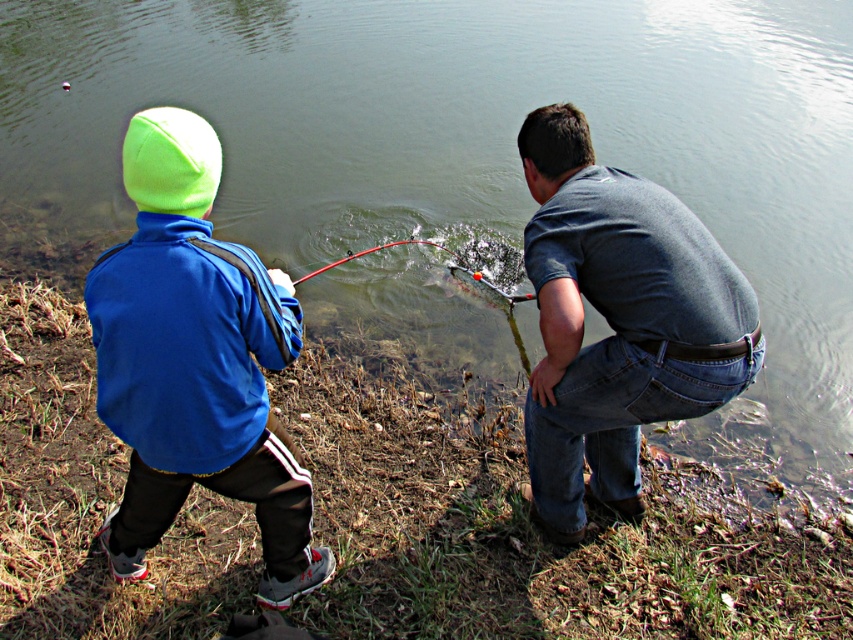
You are a fashion designer observing this fishing scene. You need to decide which item is narrower between the denim jeans at lower right and the shiny metallic rod at center. Which one is it?

The denim jeans at lower right is narrower than the shiny metallic rod at center.

You are standing at the origin point in the image, which is the bottom left corner. The coordinates are given as a normalized 2D plane. Where is the matte blue jacket at left located in terms of coordinates?

The matte blue jacket at left is located at coordinates point (195, 362).